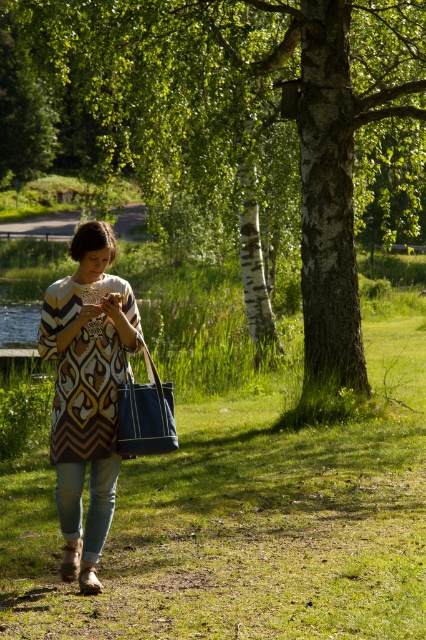
Question: Can you confirm if green bark tree at center is positioned below patterned fabric dress at center?

Choices:
 (A) yes
 (B) no

Answer: (B)

Question: Which object appears farthest from the camera in this image?

Choices:
 (A) smooth white bark at center
 (B) green grass at center
 (C) denim fabric handbag at lower center
 (D) green bark tree at center

Answer: (A)

Question: Is green grass at center bigger than patterned fabric dress at center?

Choices:
 (A) no
 (B) yes

Answer: (B)

Question: Which point is farther to the camera?

Choices:
 (A) green grass at center
 (B) denim fabric handbag at lower center
 (C) patterned fabric dress at center
 (D) green bark tree at center

Answer: (D)

Question: Which of the following is the closest to the observer?

Choices:
 (A) (124, 429)
 (B) (60, 436)

Answer: (A)

Question: Can you confirm if green grass at center is positioned to the left of patterned fabric dress at center?

Choices:
 (A) no
 (B) yes

Answer: (A)